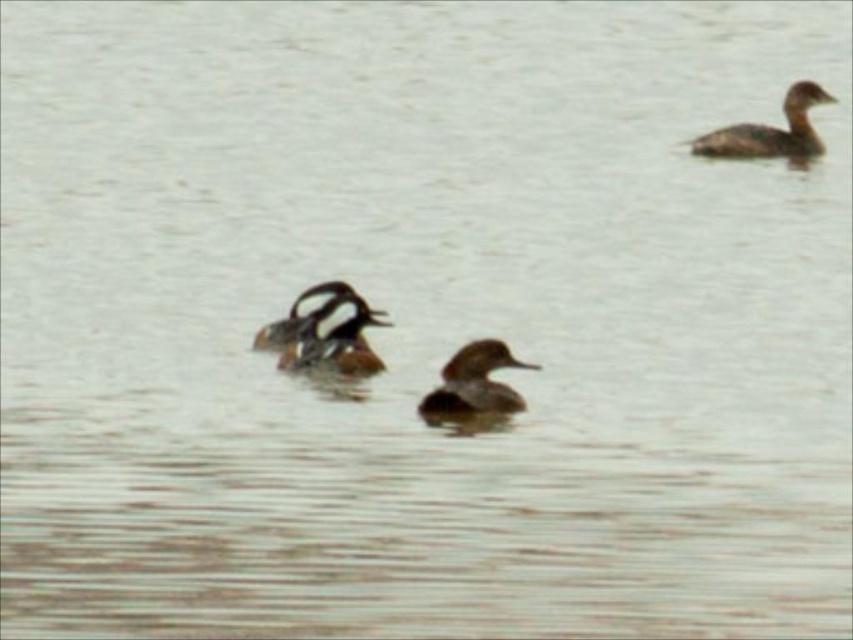
You are a wildlife photographer trying to capture a closeup shot of both the brown fuzzy duck at center and the brown matte duck at center. Your camera has a maximum focus range of 25 inches. Can you fit both ducks into your shot without moving the camera?

The brown fuzzy duck at center and brown matte duck at center are 25.54 inches apart. Since the distance between them exceeds the camera focus range of 25 inches, you cannot fit both into the shot without moving the camera.